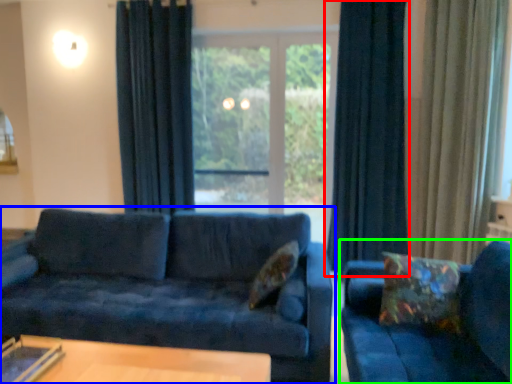
Question: Based on their relative distances, which object is nearer to curtain (highlighted by a red box)? Choose from studio couch (highlighted by a blue box) and studio couch (highlighted by a green box).

Choices:
 (A) studio couch
 (B) studio couch

Answer: (A)